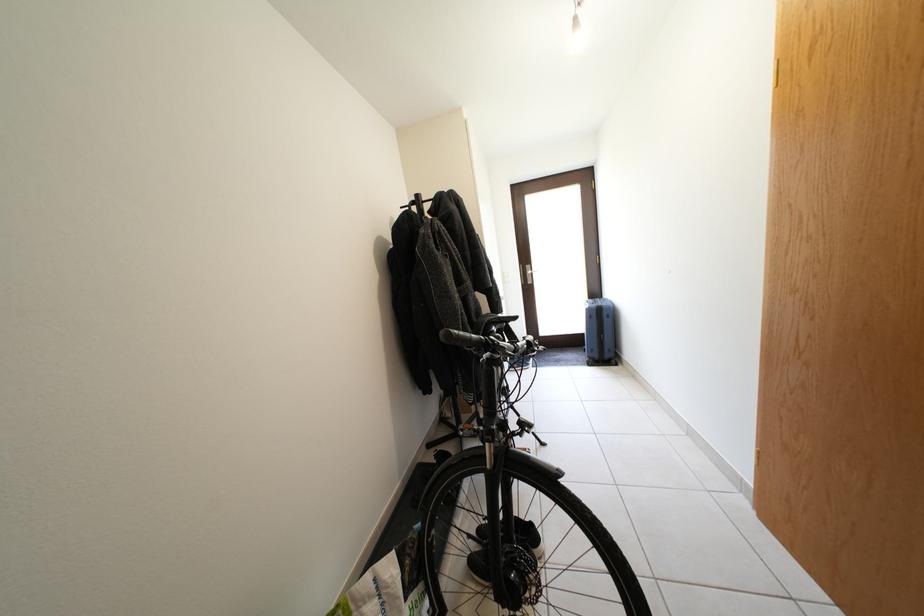
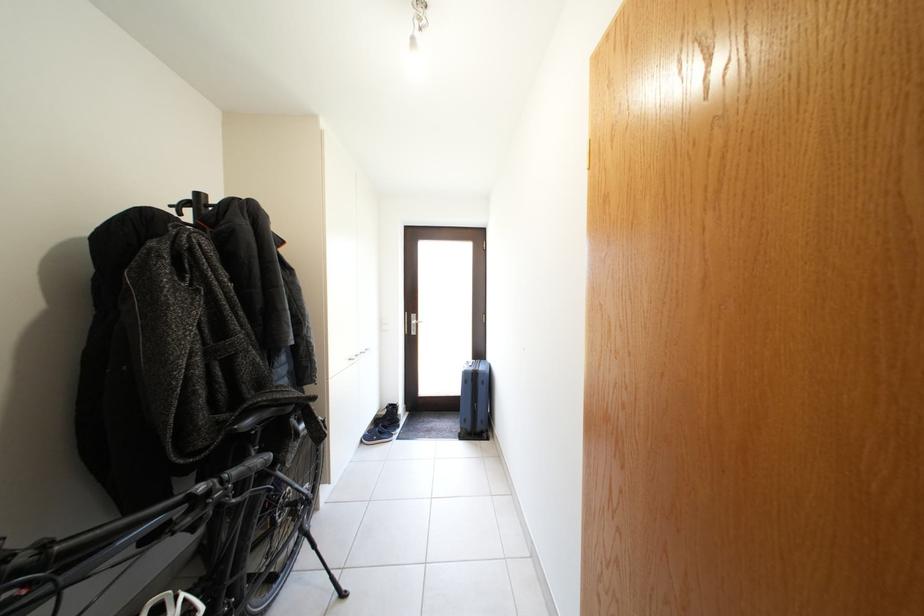
The point at (x=598, y=315) is marked in the first image. Where is the corresponding point in the second image?

(473, 379)